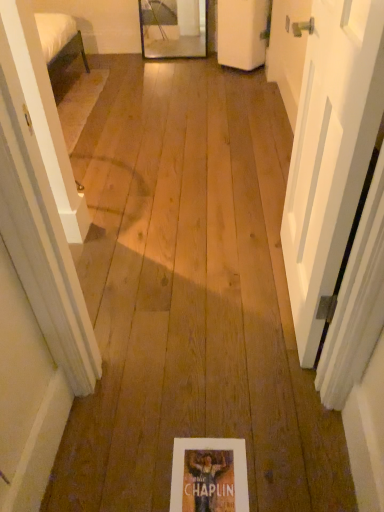
Find the location of a particular element. This screenshot has width=384, height=512. free point above matte paper flyer at center (from a real-world perspective) is located at coordinates (205, 472).